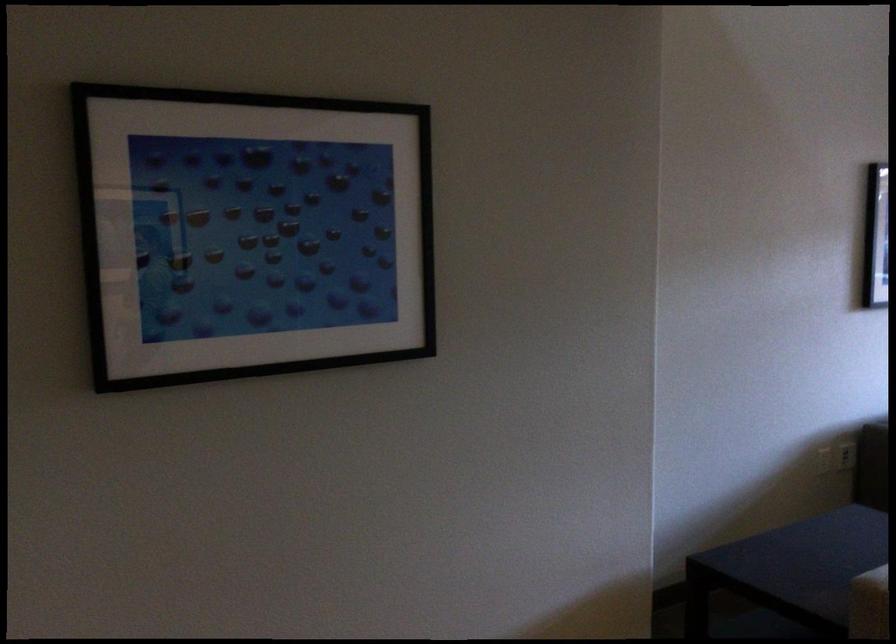
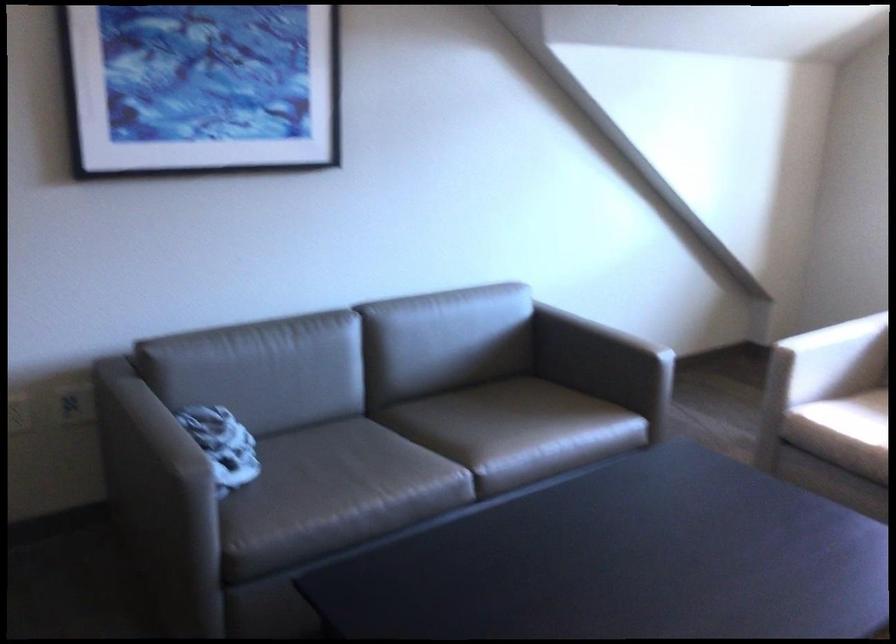
In the scene shown: The images are taken continuously from a first-person perspective. In which direction are you moving?

The cameraman walked toward right, forward.